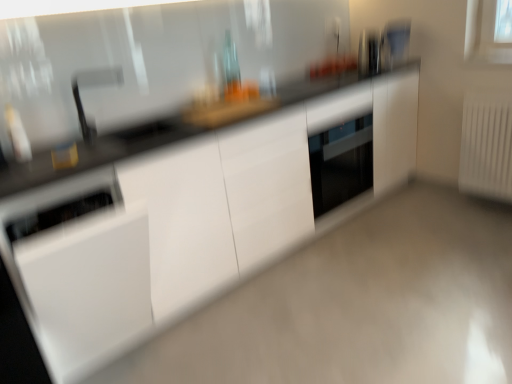
Question: Can you confirm if white glossy dishwasher at lower left, the first appliance when ordered from bottom to top, is shorter than satin silver toaster at upper right, positioned as the first appliance in right-to-left order?

Choices:
 (A) no
 (B) yes

Answer: (A)

Question: Can you confirm if white glossy dishwasher at lower left, which appears as the 3th appliance when viewed from the back, is bigger than satin silver toaster at upper right, the first appliance positioned from the back?

Choices:
 (A) yes
 (B) no

Answer: (A)

Question: Could you tell me if white glossy dishwasher at lower left, the first appliance when ordered from bottom to top, is turned towards satin silver toaster at upper right, the first appliance positioned from the back?

Choices:
 (A) yes
 (B) no

Answer: (B)

Question: Can you confirm if white glossy dishwasher at lower left, marked as the first appliance in a left-to-right arrangement, is positioned to the left of satin silver toaster at upper right, positioned as the first appliance in right-to-left order?

Choices:
 (A) yes
 (B) no

Answer: (A)

Question: Is white glossy dishwasher at lower left, marked as the first appliance in a left-to-right arrangement, positioned behind satin silver toaster at upper right, the first appliance positioned from the back?

Choices:
 (A) yes
 (B) no

Answer: (B)

Question: Would you say satin silver toaster at upper right, the 1th appliance when ordered from top to bottom, is part of white glossy dishwasher at lower left, the first appliance when ordered from bottom to top,'s contents?

Choices:
 (A) no
 (B) yes

Answer: (A)

Question: From the image's perspective, would you say white plastic radiator at right is positioned over metallic stainless steel toaster at upper right, which is the 2th appliance from right to left?

Choices:
 (A) no
 (B) yes

Answer: (A)

Question: Would you say metallic stainless steel toaster at upper right, which is the 2th appliance from right to left, is part of white plastic radiator at right's contents?

Choices:
 (A) yes
 (B) no

Answer: (B)

Question: Does white plastic radiator at right have a lesser width compared to metallic stainless steel toaster at upper right, which is the second appliance from back to front?

Choices:
 (A) no
 (B) yes

Answer: (B)

Question: Is white plastic radiator at right facing towards metallic stainless steel toaster at upper right, which is the second appliance from back to front?

Choices:
 (A) no
 (B) yes

Answer: (A)

Question: Is white plastic radiator at right facing away from metallic stainless steel toaster at upper right, marked as the 2th appliance in a front-to-back arrangement?

Choices:
 (A) yes
 (B) no

Answer: (B)

Question: Does white plastic radiator at right have a greater width compared to metallic stainless steel toaster at upper right, the second appliance in the bottom-to-top sequence?

Choices:
 (A) yes
 (B) no

Answer: (B)

Question: From the image's perspective, is white glossy cabinet at center on white glossy dishwasher at lower left, which is counted as the third appliance, starting from the top?

Choices:
 (A) yes
 (B) no

Answer: (A)